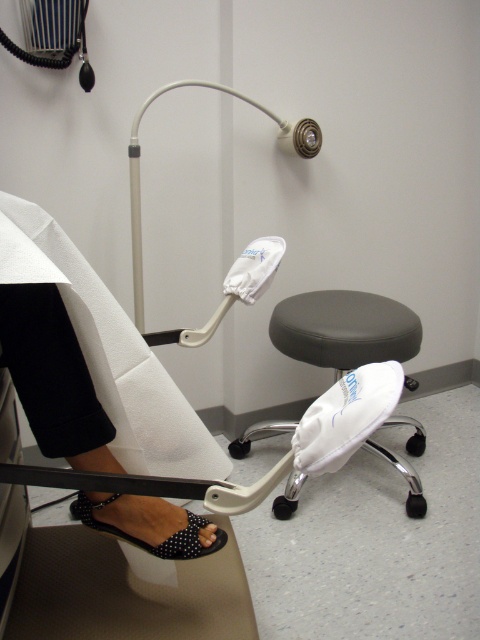
You are a healthcare worker in the clinic. You need to move the black leather stool at center to the storage room, which is 40 inches away from its current position. Can you push the stool directly to the storage room without moving the black dotted fabric sandal at lower left?

The black leather stool at center is currently 37.11 inches away from the black dotted fabric sandal at lower left. Since the storage room is only 40 inches away, you can push the stool directly to the storage room without moving the sandal because the distance between them allows enough space.